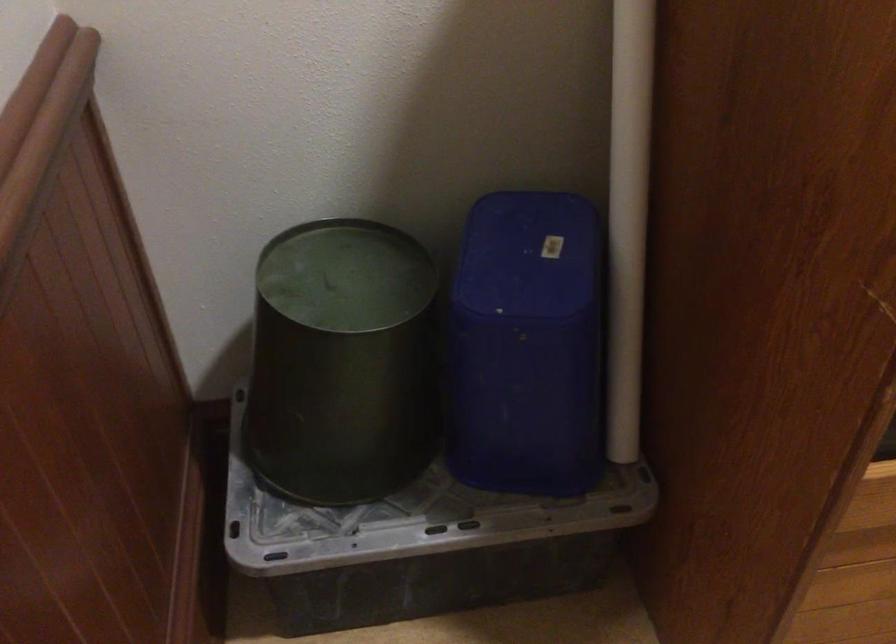
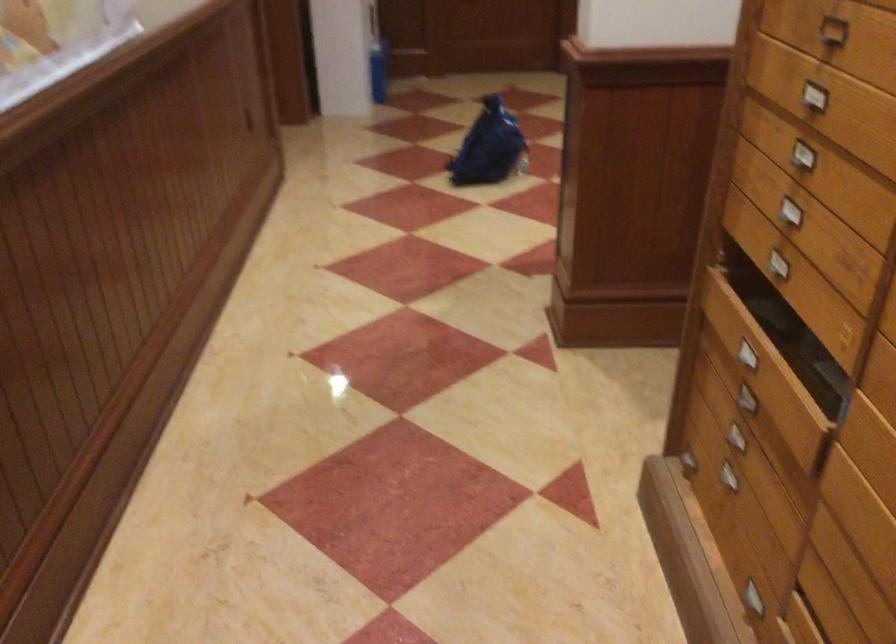
Question: I am providing you with two images of the same scene from different viewpoints. After the viewpoint changes to image2, which objects are now occluded?

Choices:
 (A) blue plastic bag
 (B) green metal can
 (C) metal drawer handle
 (D) black receiver knob

Answer: (B)